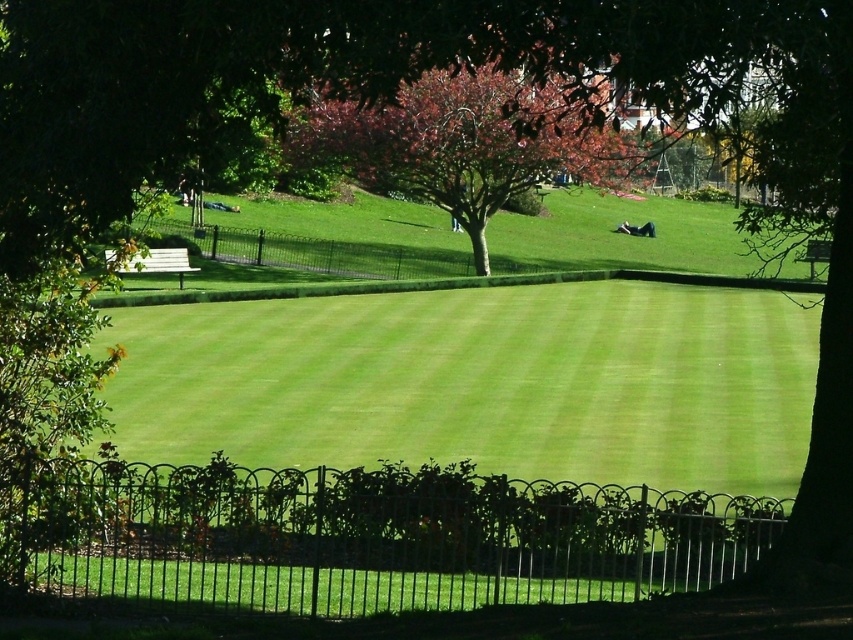
You are standing in the park and want to walk towards the two points marked in the image. Which point would you reach first, point (508, 109) or point (622, 225)?

You would reach point (508, 109) first because it is closer to the viewer than point (622, 225).

You are standing in the park and want to take a photo of the two points marked in the scene. Which point, the point at coordinates (248,422) or the point at (485,193), will appear larger in your camera view?

The point at coordinates (248,422) will appear larger in your camera view because it is closer to the camera than the point at (485,193).

You are standing at the origin point of the park map. You want to reach the green smooth lawn at center. What are the coordinates you need to move to?

The coordinates to reach the green smooth lawn at center are at point (480,381).